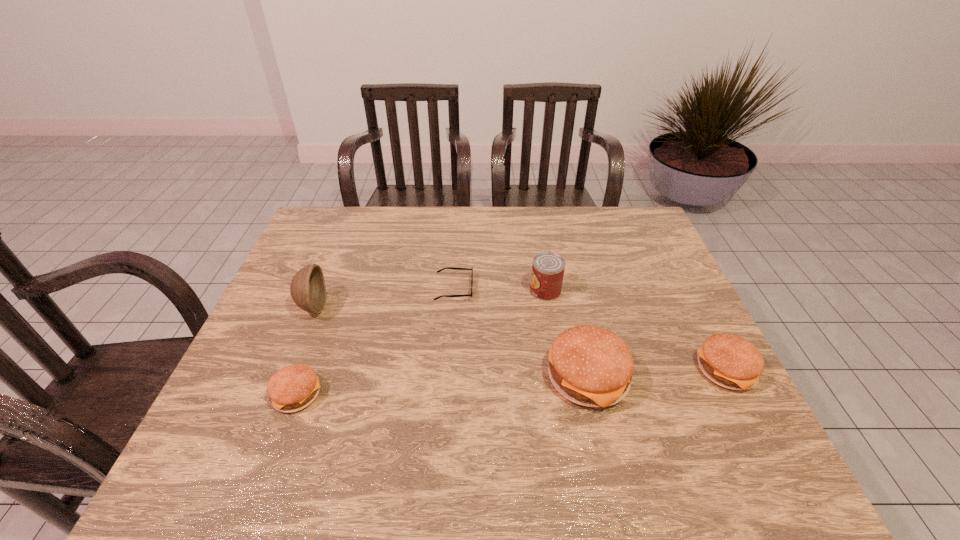
Image resolution: width=960 pixels, height=540 pixels. Identify the location of free space located on the left of the second hamburger from left to right. pos(476,378).

Find the location of a particular element. The width and height of the screenshot is (960, 540). vacant space located on the back of the second shortest hamburger is located at coordinates (667, 257).

This screenshot has height=540, width=960. What are the coordinates of `free space located on the front-facing side of the shortest object` in the screenshot? It's located at (496, 288).

This screenshot has width=960, height=540. In order to click on vacant region located on the back of the can in this screenshot , I will do `click(538, 246)`.

You are a GUI agent. You are given a task and a screenshot of the screen. Output one action in this format:
    pyautogui.click(x=<x>, y=<y>)
    Task: Click on the free space located 0.090m on the front of the tallest object
    Image resolution: width=960 pixels, height=540 pixels.
    Given the screenshot: What is the action you would take?
    pyautogui.click(x=295, y=350)

Identify the location of hamburger at the left edge. The height and width of the screenshot is (540, 960). (292, 388).

Identify the location of bowl at the left edge. The width and height of the screenshot is (960, 540). (308, 291).

At what (x,y) coordinates should I click in order to perform the action: click on object located at the right edge. Please return your answer as a coordinate pair (x, y). The height and width of the screenshot is (540, 960). Looking at the image, I should click on (730, 361).

The image size is (960, 540). I want to click on object at the near left corner, so click(x=292, y=388).

In the image, there is a desktop. At what (x,y) coordinates should I click in order to perform the action: click on free space at the far edge. Please return your answer as a coordinate pair (x, y). The width and height of the screenshot is (960, 540). Looking at the image, I should click on (543, 240).